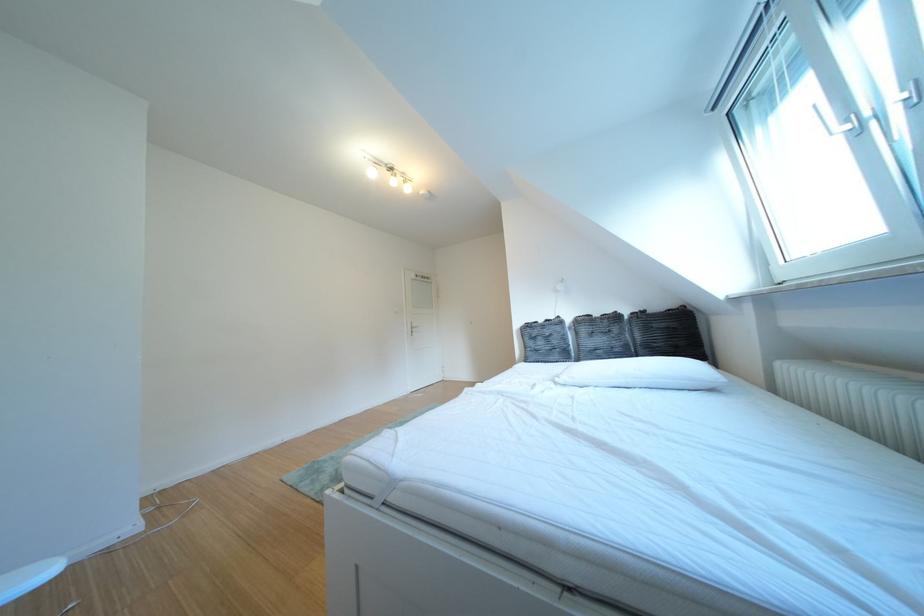
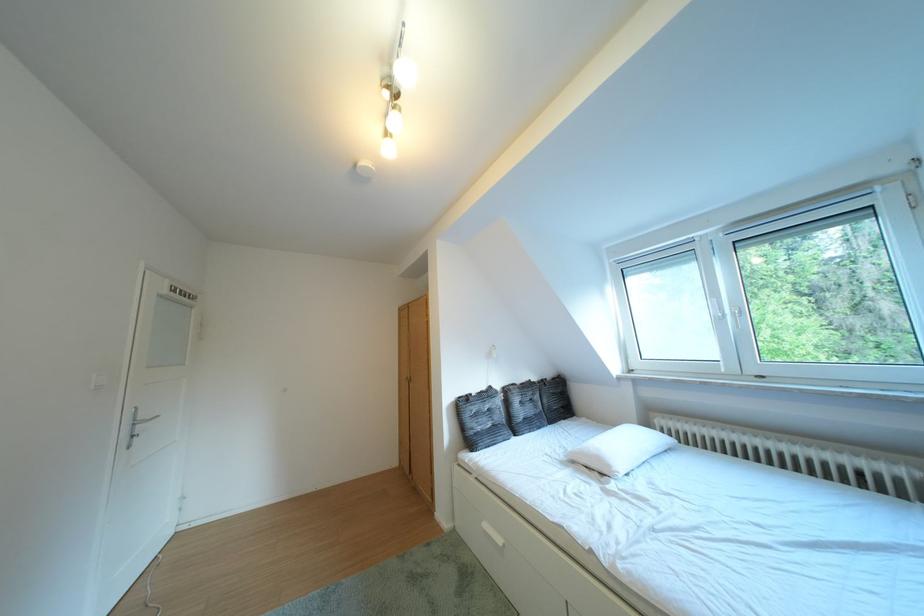
In the second image, find the point that corresponds to (x=573, y=323) in the first image.

(504, 392)